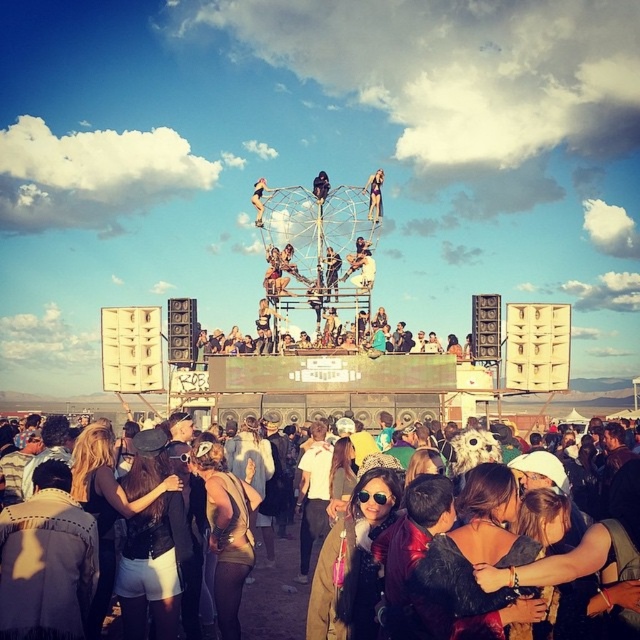
Which is below, metallic silver microphone at center or matte black bikini at center?

metallic silver microphone at center is below.

Is metallic silver microphone at center wider than matte black bikini at center?

Correct, the width of metallic silver microphone at center exceeds that of matte black bikini at center.

Which is in front, point (225, 340) or point (260, 225)?

Positioned in front is point (225, 340).

Where is `metallic silver microphone at center`? metallic silver microphone at center is located at coordinates (326, 340).

Between metallic silver pole at center and metallic silver figure at center, which one is positioned higher?

metallic silver figure at center is above.

Does point (371, 196) lie in front of point (316, 193)?

Yes, point (371, 196) is in front of point (316, 193).

Identify the location of metallic silver pole at center. pos(374,195).

Locate an element on the screen. The image size is (640, 640). metallic silver pole at center is located at coordinates (374, 195).

Who is positioned more to the right, matte black jacket at lower center or matte black bikini at center?

matte black bikini at center is more to the right.

Does matte black jacket at lower center have a greater height compared to matte black bikini at center?

Correct, matte black jacket at lower center is much taller as matte black bikini at center.

Is point (296, 637) positioned after point (252, 193)?

No, (296, 637) is closer to viewer.

Find the location of `matte black jacket at lower center`. matte black jacket at lower center is located at coordinates (275, 598).